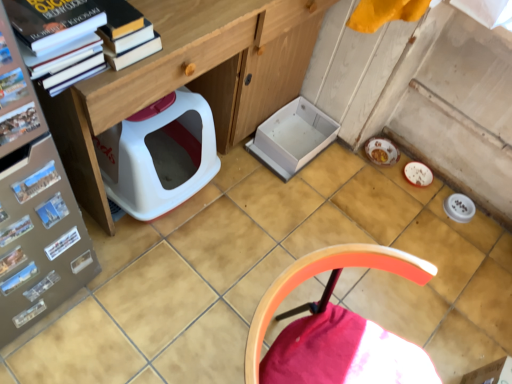
This screenshot has height=384, width=512. I want to click on free area in between matte wood desk at center and wooden chair at lower right, so click(x=234, y=256).